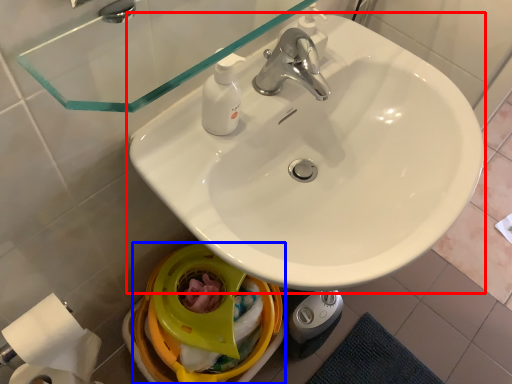
Question: Among these objects, which one is nearest to the camera, sink (highlighted by a red box) or bidet (highlighted by a blue box)?

Choices:
 (A) sink
 (B) bidet

Answer: (A)